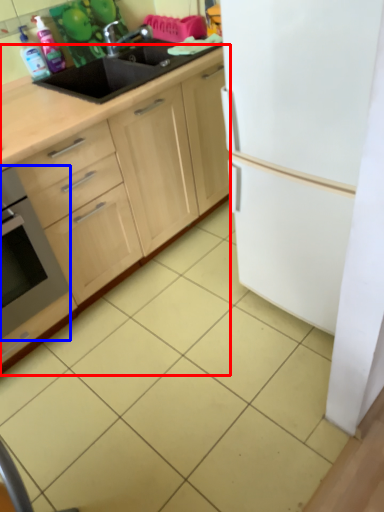
Question: Which object is closer to the camera taking this photo, cabinetry (highlighted by a red box) or home appliance (highlighted by a blue box)?

Choices:
 (A) cabinetry
 (B) home appliance

Answer: (A)